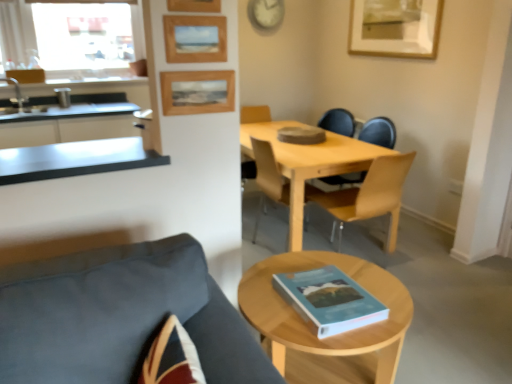
Question: Would you say dark gray fabric chair at lower left, acting as the first chair starting from the front, is inside or outside light wood table at center?

Choices:
 (A) inside
 (B) outside

Answer: (B)

Question: Is dark gray fabric chair at lower left, the third chair viewed from the back, wider or thinner than light wood table at center?

Choices:
 (A) wide
 (B) thin

Answer: (A)

Question: Which object is the closest to the satin steel countertop at left?

Choices:
 (A) clear glass window at upper left
 (B) light wood coffee table at center
 (C) blue matte book at lower center
 (D) light wood table at center
 (E) wooden picture frame at upper center, which is the 3th picture frame in right-to-left order

Answer: (A)

Question: Which object is positioned closest to the clear glass window at upper left?

Choices:
 (A) blue matte book at lower center
 (B) satin steel countertop at left
 (C) wooden chair at center, which appears as the 1th chair when viewed from the back
 (D) wooden picture frame at upper center, which is the 3th picture frame in right-to-left order
 (E) light wood coffee table at center

Answer: (B)